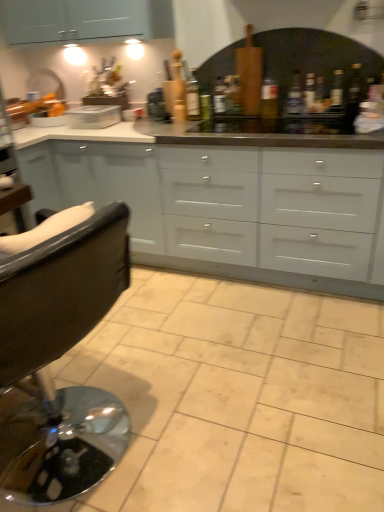
The height and width of the screenshot is (512, 384). Identify the location of vacant space in front of translucent glass bottle at upper center, placed as the third bottle when sorted from right to left. pos(297,120).